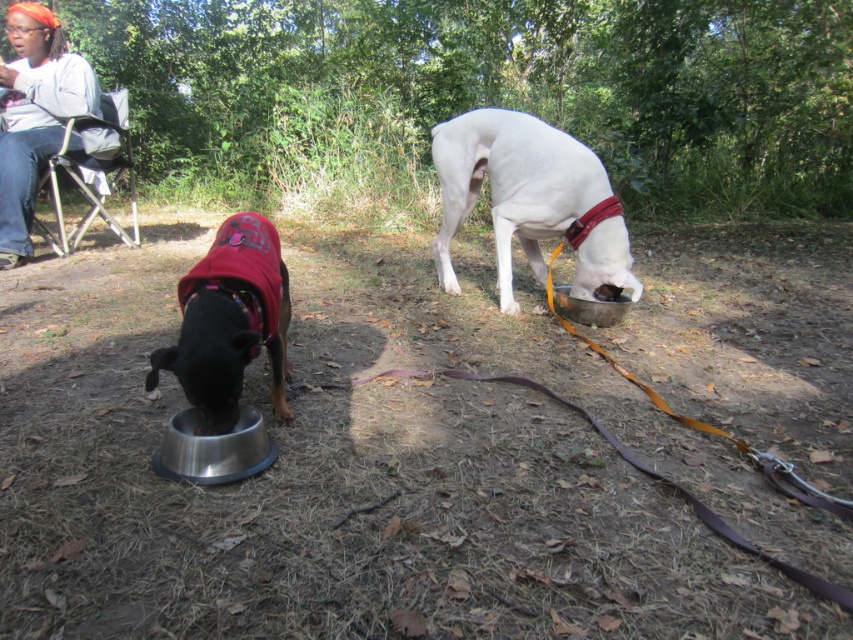
Question: Which point is farther to the camera?

Choices:
 (A) (575, 268)
 (B) (200, 262)

Answer: (A)

Question: Which object is farther from the camera taking this photo?

Choices:
 (A) white matte dog bowl at center
 (B) shiny black dog at lower left

Answer: (A)

Question: Does white matte dog bowl at center appear on the left side of stainless steel bowl at center?

Choices:
 (A) yes
 (B) no

Answer: (A)

Question: Which point is closer to the camera?

Choices:
 (A) stainless steel bowl at center
 (B) shiny black dog at lower left

Answer: (B)

Question: Does white matte dog bowl at center appear under stainless steel bowl at center?

Choices:
 (A) yes
 (B) no

Answer: (B)

Question: Does shiny black dog at lower left appear on the left side of stainless steel bowl at center?

Choices:
 (A) yes
 (B) no

Answer: (A)